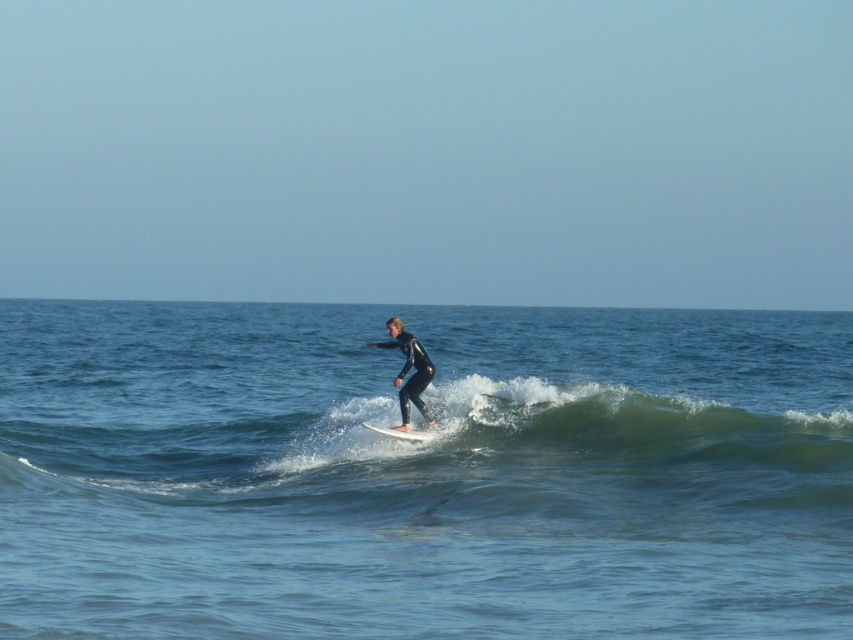
Can you confirm if black matte wetsuit at center is positioned above white smooth surfboard at center?

Correct, black matte wetsuit at center is located above white smooth surfboard at center.

Does point (410, 387) come farther from viewer compared to point (424, 429)?

No, (410, 387) is in front of (424, 429).

Locate an element on the screen. Image resolution: width=853 pixels, height=640 pixels. black matte wetsuit at center is located at coordinates (407, 371).

I want to click on black matte wetsuit at center, so click(x=407, y=371).

Is clear blue water at wave center thinner than white smooth surfboard at center?

In fact, clear blue water at wave center might be wider than white smooth surfboard at center.

Measure the distance between clear blue water at wave center and camera.

A distance of 8.59 meters exists between clear blue water at wave center and camera.

Describe the element at coordinates (422, 474) in the screenshot. I see `clear blue water at wave center` at that location.

The image size is (853, 640). I want to click on clear blue water at wave center, so point(422,474).

Looking at this image, is clear blue water at wave center smaller than black matte wetsuit at center?

Actually, clear blue water at wave center might be larger than black matte wetsuit at center.

Does clear blue water at wave center have a larger size compared to black matte wetsuit at center?

Indeed, clear blue water at wave center has a larger size compared to black matte wetsuit at center.

What do you see at coordinates (422, 474) in the screenshot?
I see `clear blue water at wave center` at bounding box center [422, 474].

Where is `clear blue water at wave center`? Image resolution: width=853 pixels, height=640 pixels. clear blue water at wave center is located at coordinates (422, 474).